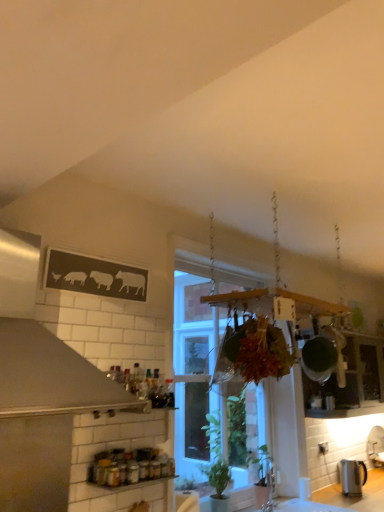
Question: In the image, is satin silver exhaust hood at upper left positioned in front of or behind clear glass window at center?

Choices:
 (A) front
 (B) behind

Answer: (A)

Question: From a real-world perspective, is satin silver exhaust hood at upper left physically located above or below clear glass window at center?

Choices:
 (A) below
 (B) above

Answer: (B)

Question: Based on their relative distances, which object is farther from the satin silver kettle at lower right?

Choices:
 (A) clear glass window at center
 (B) satin silver exhaust hood at upper left
 (C) metallic glass jars at lower center

Answer: (B)

Question: Which of these objects is positioned farthest from the satin silver exhaust hood at upper left?

Choices:
 (A) metallic glass jars at lower center
 (B) satin silver kettle at lower right
 (C) clear glass window at center

Answer: (C)